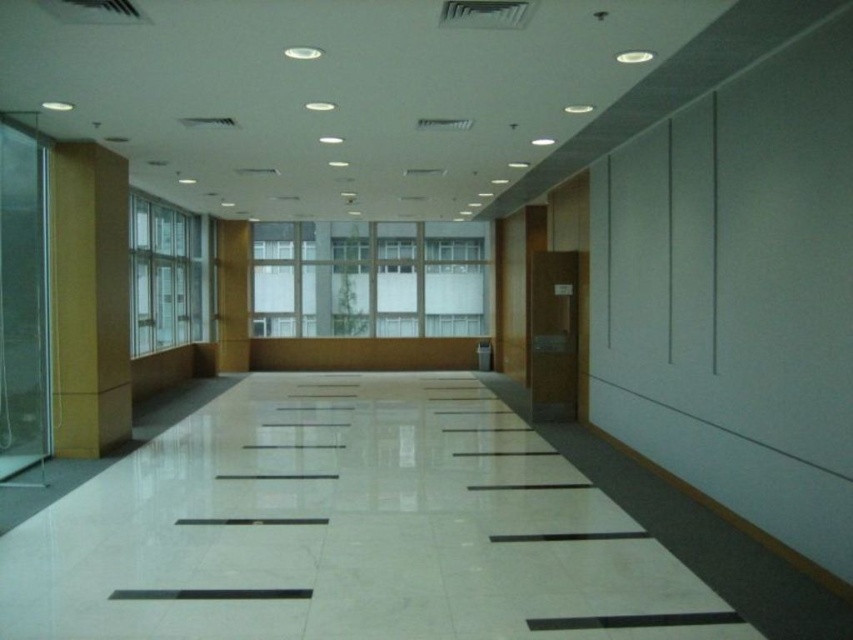
Looking at this image, between clear glass window at center and clear glass window at left, which one is positioned lower?

clear glass window at center

Which of these two, clear glass window at center or clear glass window at left, stands taller?

Standing taller between the two is clear glass window at left.

The image size is (853, 640). Find the location of `clear glass window at center`. clear glass window at center is located at coordinates (367, 278).

Is matte yellow wall at left above clear glass window at left?

No.

Can you confirm if matte yellow wall at left is bigger than clear glass window at left?

Incorrect, matte yellow wall at left is not larger than clear glass window at left.

Is point (57, 452) less distant than point (137, 204)?

Yes, point (57, 452) is in front of point (137, 204).

I want to click on matte yellow wall at left, so click(x=88, y=300).

Measure the distance between clear glass window at center and matte yellow wall at left.

clear glass window at center is 30.61 feet away from matte yellow wall at left.

Who is lower down, clear glass window at center or matte yellow wall at left?

matte yellow wall at left is below.

Is point (404, 253) less distant than point (96, 189)?

That is False.

Locate an element on the screen. The width and height of the screenshot is (853, 640). clear glass window at center is located at coordinates (367, 278).